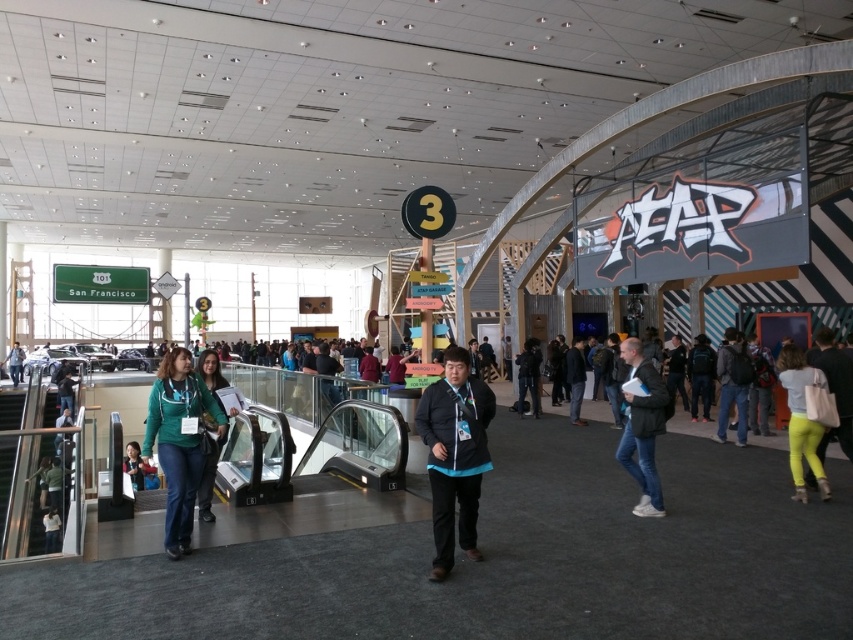
Can you confirm if white leather jacket at lower right is shorter than green fabric jacket at center?

In fact, white leather jacket at lower right may be taller than green fabric jacket at center.

Which is below, white leather jacket at lower right or green fabric jacket at center?

Positioned lower is white leather jacket at lower right.

Is point (618, 449) behind point (213, 394)?

Yes, it is behind point (213, 394).

You are a GUI agent. You are given a task and a screenshot of the screen. Output one action in this format:
    pyautogui.click(x=<x>, y=<y>)
    Task: Click on the white leather jacket at lower right
    The width and height of the screenshot is (853, 640).
    Given the screenshot: What is the action you would take?
    pyautogui.click(x=642, y=426)

Identify the location of black fabric jacket at center. (454, 454).

Describe the element at coordinates (454, 454) in the screenshot. The width and height of the screenshot is (853, 640). I see `black fabric jacket at center` at that location.

Locate an element on the screen. The height and width of the screenshot is (640, 853). black fabric jacket at center is located at coordinates (454, 454).

Looking at this image, does green fabric jacket at lower left have a greater width compared to green fabric jacket at center?

Incorrect, green fabric jacket at lower left's width does not surpass green fabric jacket at center's.

Image resolution: width=853 pixels, height=640 pixels. Find the location of `green fabric jacket at lower left`. green fabric jacket at lower left is located at coordinates (x=178, y=440).